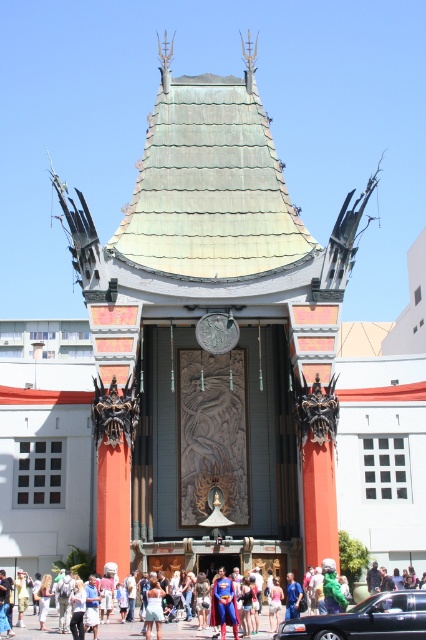
You are a photographer planning to take a photo of the Grauman Chinese Theatre. You see a shiny black sedan at center and a blue fabric superhero costume at center. Which object is more to the left?

The blue fabric superhero costume at center is more to the left because the shiny black sedan at center is positioned on the right side of it.